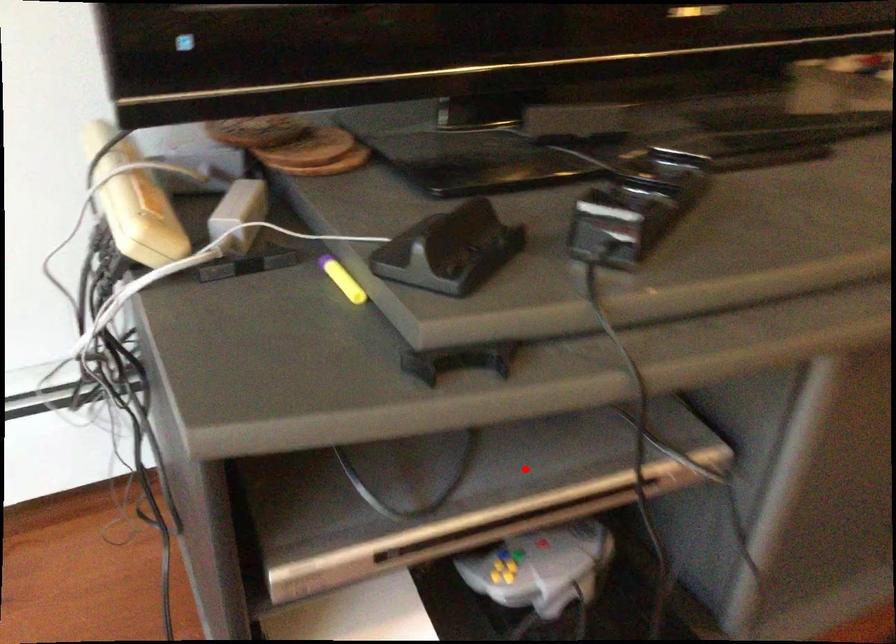
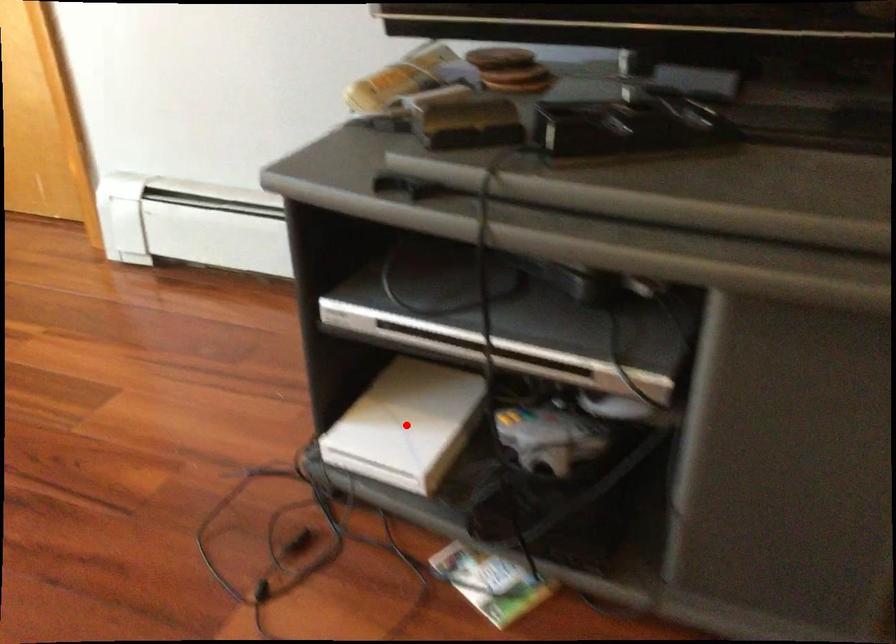
I am providing you with two images of the same scene from different viewpoints. A red point is marked on the first image and another point is marked on the second image. Do the highlighted points in image1 and image2 indicate the same real-world spot?

No